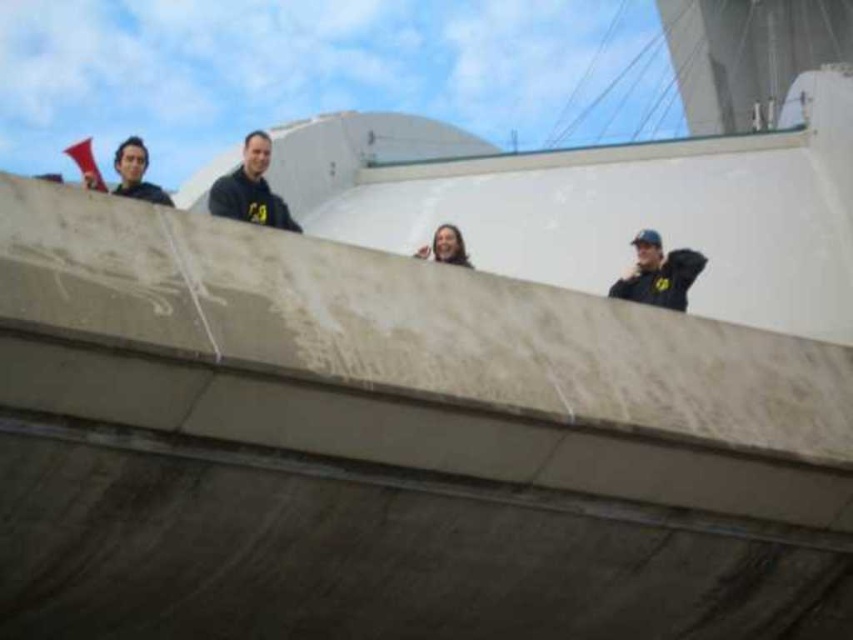
You are a photographer on the deck of a cruise ship and want to capture a photo of both the black matte jacket at upper right and the matte black shirt at upper left. However, you notice that one of them is blocking the view of the other. Which one is blocking the other?

The black matte jacket at upper right is positioned under the matte black shirt at upper left, so the matte black shirt at upper left is blocking the view of the black matte jacket at upper right.

You are a passenger on the ship and want to find the person wearing the black matte jacket at center. Where should you look relative to the person wearing the matte black shirt at upper left?

The black matte jacket at center is located above the matte black shirt at upper left, so you should look upwards from the person wearing the matte black shirt at upper left to find the person in the black matte jacket at center.

You are a photographer on the ship deck and want to take a photo of the black matte jacket at center and the matte black shirt at upper left. Which one will appear larger in the photo?

The black matte jacket at center appears larger in the photo because it is closer to the photographer than the matte black shirt at upper left.